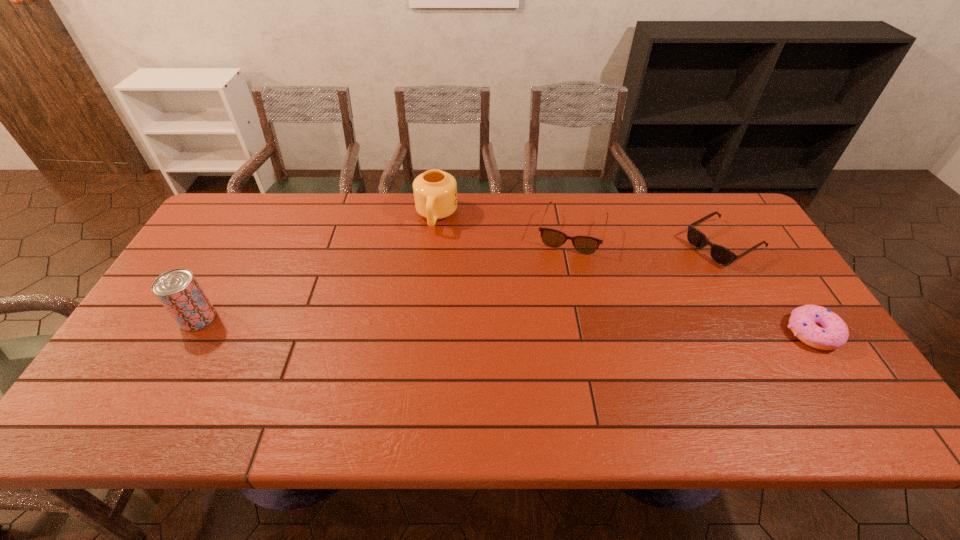
Identify the location of free space between the doughnut and the leftmost object. Image resolution: width=960 pixels, height=540 pixels. (505, 326).

Locate an element on the screen. Image resolution: width=960 pixels, height=540 pixels. blank region between the leftmost object and the sunglasses is located at coordinates (461, 281).

The height and width of the screenshot is (540, 960). I want to click on empty location between the mug and the beer can, so click(x=317, y=267).

Identify the location of free area in between the third object from left to right and the sunglasses. (648, 239).

Where is `vacant space that is in between the spectacles and the mug`? vacant space that is in between the spectacles and the mug is located at coordinates (504, 225).

You are a GUI agent. You are given a task and a screenshot of the screen. Output one action in this format:
    pyautogui.click(x=<x>, y=<y>)
    Task: Click on the vacant space that's between the spectacles and the sunglasses
    Image resolution: width=960 pixels, height=540 pixels.
    Given the screenshot: What is the action you would take?
    pyautogui.click(x=648, y=239)

Locate an element on the screen. The image size is (960, 540). free space between the sunglasses and the second object from left to right is located at coordinates (580, 230).

The height and width of the screenshot is (540, 960). In order to click on free area in between the doughnut and the sunglasses in this screenshot , I will do `click(768, 288)`.

Find the location of `empty space that is in between the sunglasses and the leftmost object`. empty space that is in between the sunglasses and the leftmost object is located at coordinates (461, 281).

This screenshot has height=540, width=960. I want to click on object that ranks as the third closest to the sunglasses, so click(435, 192).